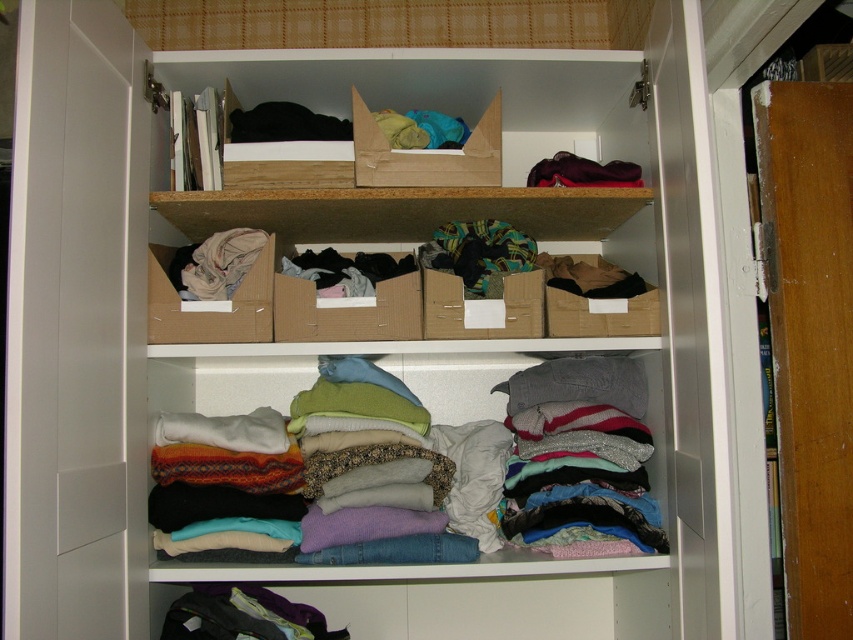
Question: Can you confirm if light beige fabric at center is positioned to the right of black fabric at upper center?

Choices:
 (A) no
 (B) yes

Answer: (A)

Question: Which object is the closest to the light beige fabric at center?

Choices:
 (A) cardboard box at center
 (B) soft cotton sweaters at center
 (C) black fabric at upper center
 (D) dark purple fabric at upper center

Answer: (C)

Question: Considering the relative positions of soft cotton sweaters at center and black fabric at upper center in the image provided, where is soft cotton sweaters at center located with respect to black fabric at upper center?

Choices:
 (A) below
 (B) above

Answer: (A)

Question: Which of the following is the farthest from the observer?

Choices:
 (A) (610, 179)
 (B) (433, 288)

Answer: (A)

Question: Which point is farther from the camera taking this photo?

Choices:
 (A) [247, 262]
 (B) [637, 378]

Answer: (B)

Question: Is cardboard box at center bigger than light beige fabric at center?

Choices:
 (A) yes
 (B) no

Answer: (B)